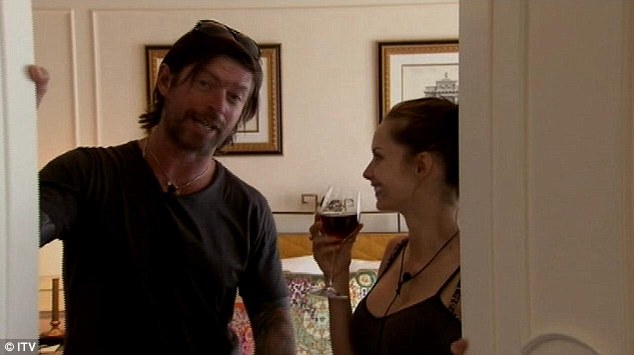
You are a GUI agent. You are given a task and a screenshot of the screen. Output one action in this format:
    pyautogui.click(x=<x>, y=<y>)
    Task: Click on the door
    This screenshot has width=634, height=355.
    Given the screenshot: What is the action you would take?
    [541, 255]